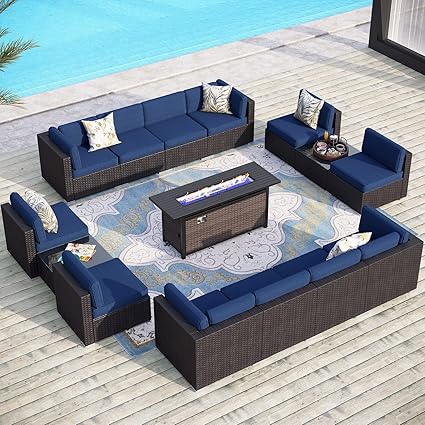
You are a GUI agent. You are given a task and a screenshot of the screen. Output one action in this format:
    pyautogui.click(x=<x>, y=<y>)
    Task: Click on the couch
    The height and width of the screenshot is (425, 425).
    Given the screenshot: What is the action you would take?
    pyautogui.click(x=142, y=137), pyautogui.click(x=258, y=276)